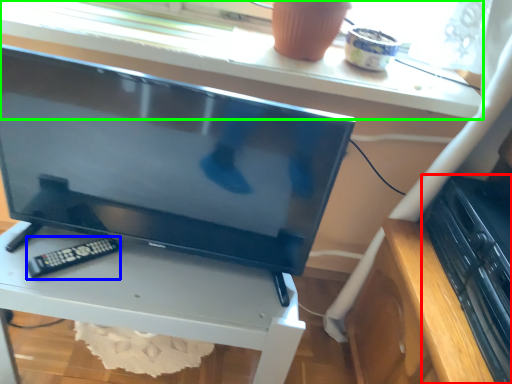
Question: Which is nearer to the appliance (highlighted by a red box)? control (highlighted by a blue box) or window sill (highlighted by a green box).

Choices:
 (A) control
 (B) window sill

Answer: (B)